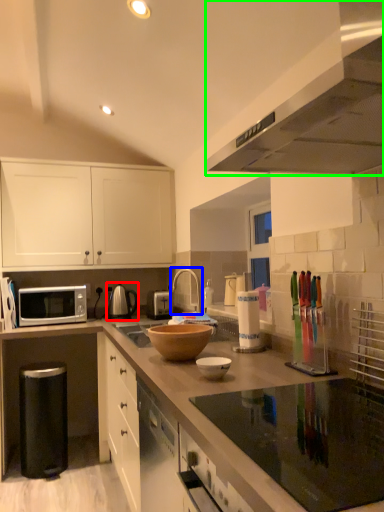
Question: Estimate the real-world distances between objects in this image. Which object is farther from tea pot (highlighted by a red box), tap (highlighted by a blue box) or kitchen appliance (highlighted by a green box)?

Choices:
 (A) tap
 (B) kitchen appliance

Answer: (B)